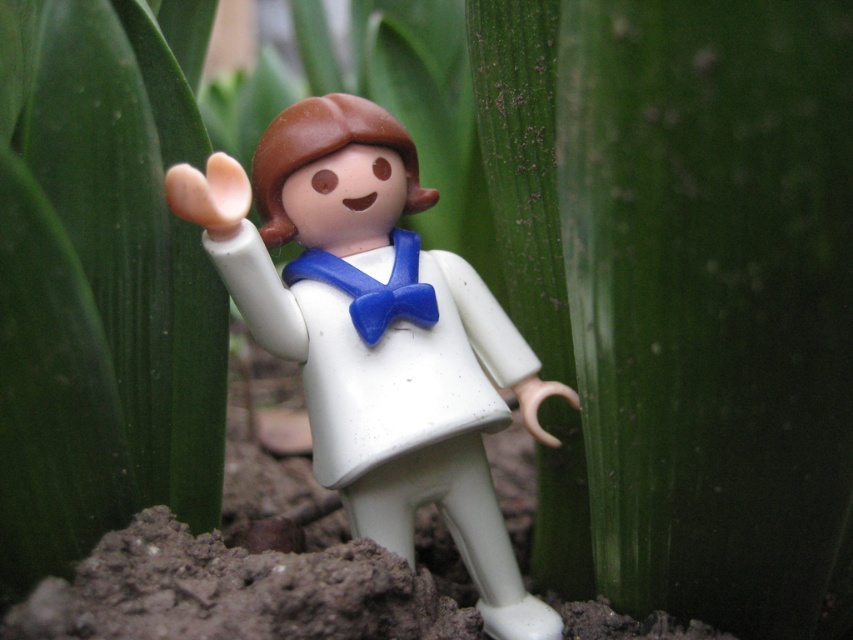
Question: Can you confirm if green matte leaf at center is bigger than blue plastic bow tie at center?

Choices:
 (A) yes
 (B) no

Answer: (A)

Question: Is green matte leaf at center further to camera compared to blue plastic bow tie at center?

Choices:
 (A) no
 (B) yes

Answer: (A)

Question: Does white plastic toy at center appear on the left side of blue plastic bow tie at center?

Choices:
 (A) no
 (B) yes

Answer: (A)

Question: Which of the following is the farthest from the observer?

Choices:
 (A) (289, 273)
 (B) (396, 316)

Answer: (A)

Question: Among these objects, which one is nearest to the camera?

Choices:
 (A) blue plastic bow tie at center
 (B) green matte leaf at center

Answer: (B)

Question: Which point is farther to the camera?

Choices:
 (A) [x=112, y=26]
 (B) [x=395, y=291]

Answer: (B)